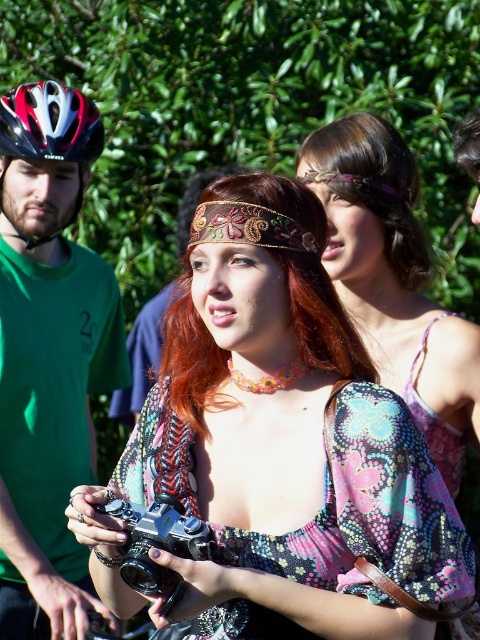
Question: Which is farther from the matte black helmet at left?

Choices:
 (A) reddish-brown fabric hair at center
 (B) brownhair at center
 (C) multicolored fabric dress at center
 (D) floral-patterned blouse at center

Answer: (B)

Question: Which point appears closest to the camera in this image?

Choices:
 (A) (27, 154)
 (B) (303, 458)

Answer: (B)

Question: Can you confirm if floral-patterned blouse at center is positioned below black plastic camera at center?

Choices:
 (A) yes
 (B) no

Answer: (B)

Question: Where is reddish-brown fabric hair at center located in relation to black plastic camera at center in the image?

Choices:
 (A) above
 (B) below

Answer: (A)

Question: Which object appears closest to the camera in this image?

Choices:
 (A) brownhair at center
 (B) reddish-brown fabric hair at center
 (C) multicolored fabric dress at center

Answer: (B)

Question: Is the position of multicolored fabric dress at center more distant than that of reddish-brown fabric hair at center?

Choices:
 (A) yes
 (B) no

Answer: (A)